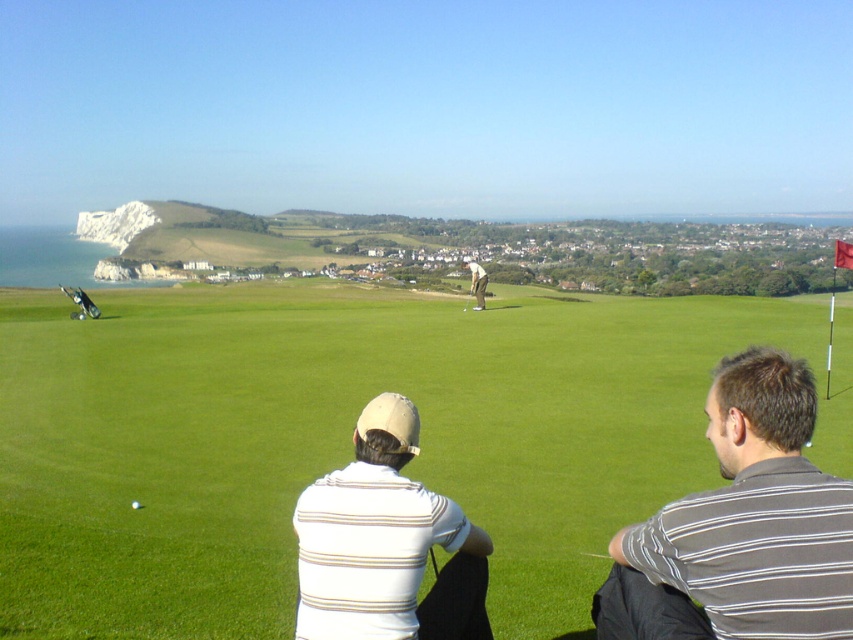
Is green grass at center shorter than metallic silver golf club at center?

No.

From the picture: Who is positioned more to the right, green grass at center or metallic silver golf club at center?

metallic silver golf club at center is more to the right.

The height and width of the screenshot is (640, 853). I want to click on green grass at center, so click(346, 440).

This screenshot has width=853, height=640. Identify the location of green grass at center. (346, 440).

Does white striped shirt at lower center appear on the right side of metallic silver golf club at center?

Incorrect, white striped shirt at lower center is not on the right side of metallic silver golf club at center.

Can you confirm if white striped shirt at lower center is positioned below metallic silver golf club at center?

Indeed, white striped shirt at lower center is positioned under metallic silver golf club at center.

Does point (364, 413) come behind point (471, 291)?

No, it is in front of (471, 291).

You are a GUI agent. You are given a task and a screenshot of the screen. Output one action in this format:
    pyautogui.click(x=<x>, y=<y>)
    Task: Click on the white striped shirt at lower center
    This screenshot has height=640, width=853.
    Given the screenshot: What is the action you would take?
    pyautogui.click(x=386, y=544)

Who is shorter, gray striped shirt at lower right or white striped shirt at lower center?

white striped shirt at lower center

Does gray striped shirt at lower right appear under white striped shirt at lower center?

Actually, gray striped shirt at lower right is above white striped shirt at lower center.

Find the location of a particular element. The image size is (853, 640). gray striped shirt at lower right is located at coordinates (741, 525).